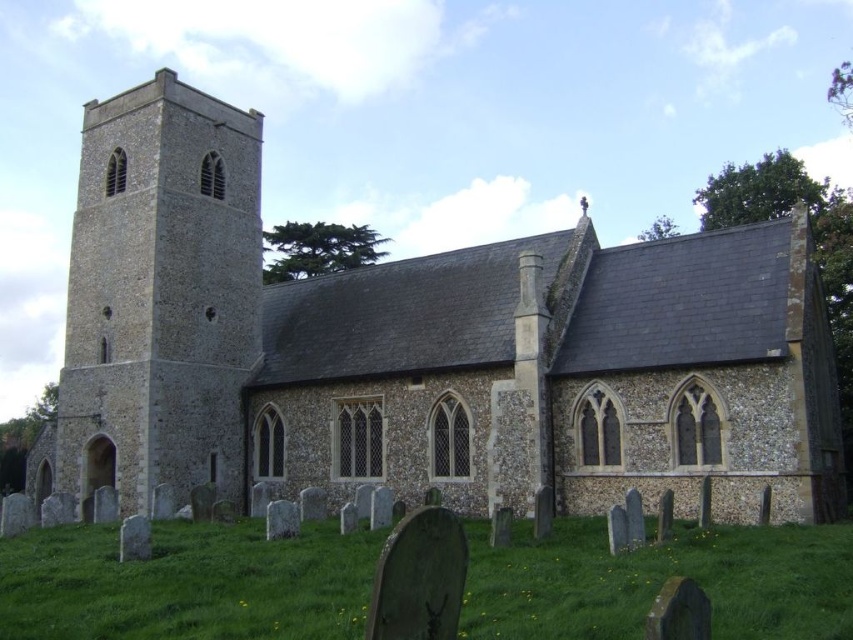
You are planning to place a new rectangular flower bed in the graveyard. The flower bed must be placed between the stone church at center and the green grass at lower center. Which object should the flower bed be closer to if it needs to be wider than the other?

The flower bed should be closer to the green grass at lower center because the stone church at center might be wider than the green grass at lower center, so placing it closer to the grass allows the flower bed to be wider than the grass area but narrower than the church.

You are standing at the entrance of the traditional stone church with a tall, narrow tower on the left side and a main body extending to the right. You want to find the green grass at lower center. According to the coordinates provided, where should you look relative to the church?

The green grass at lower center is located at coordinates point (187, 582), which is to the lower right of the church.